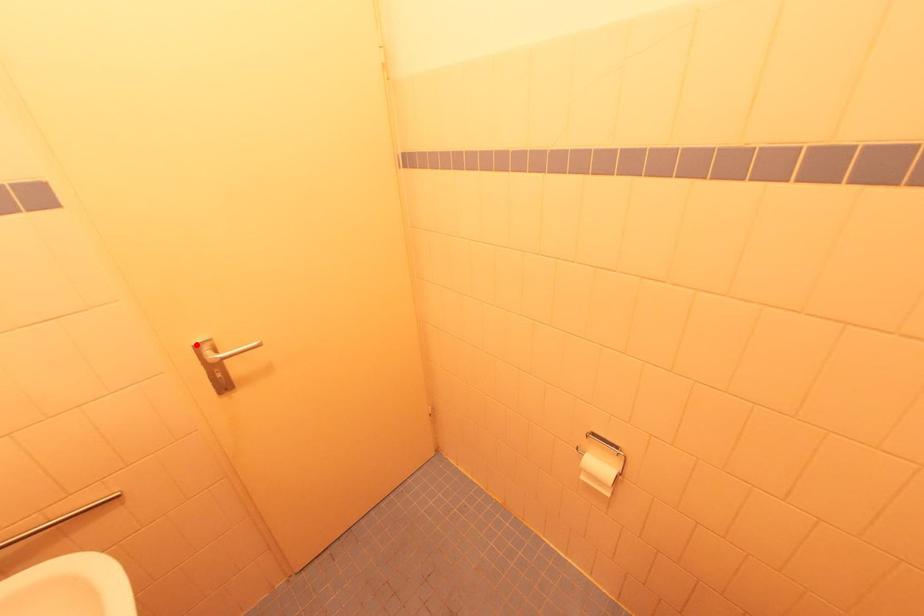
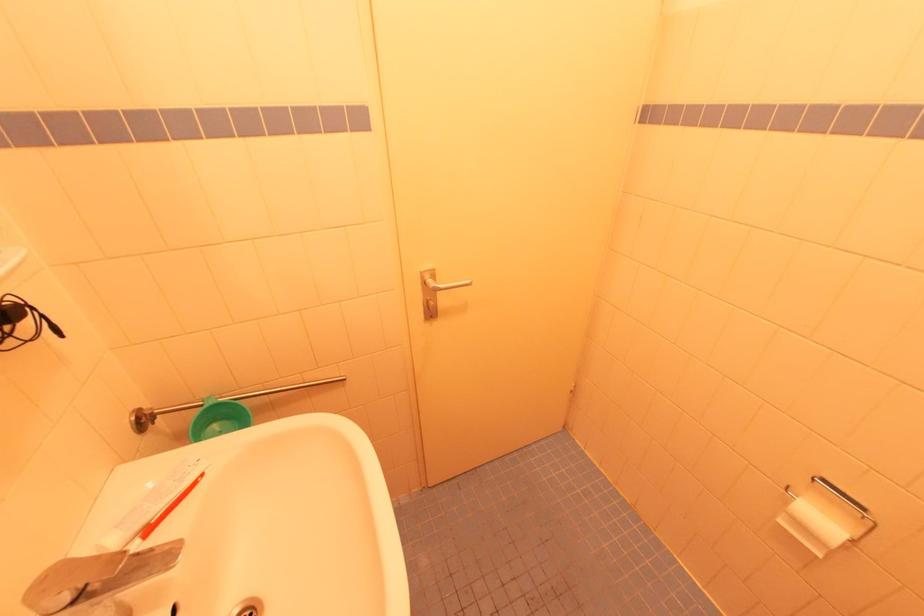
In the second image, find the point that corresponds to the highlighted location in the first image.

(423, 272)